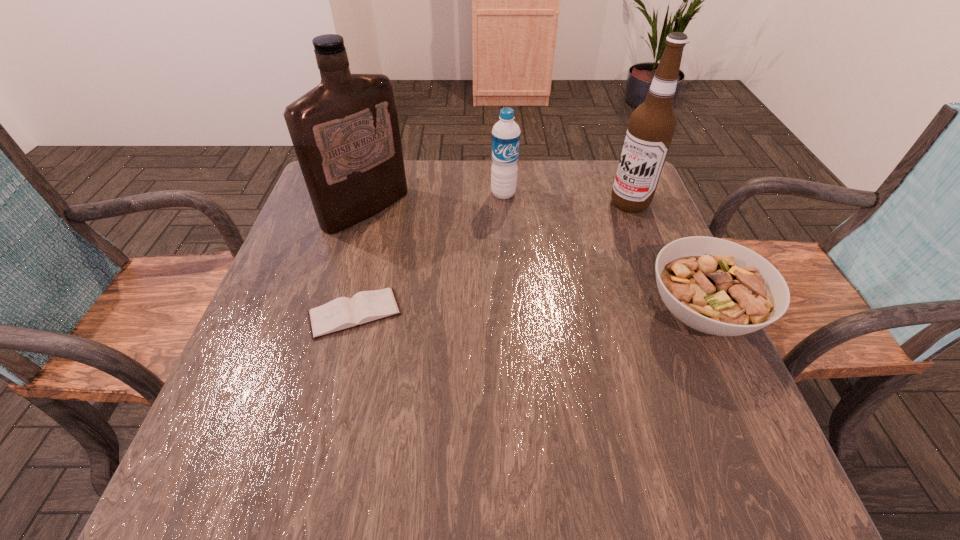
Locate an element on the screen. Image resolution: width=960 pixels, height=540 pixels. vacant space at the near left corner is located at coordinates (284, 404).

This screenshot has height=540, width=960. What are the coordinates of `free space between the second shortest object and the shortest object` in the screenshot? It's located at (528, 313).

Where is `free spot between the diary and the liquor`? free spot between the diary and the liquor is located at coordinates (361, 261).

You are a GUI agent. You are given a task and a screenshot of the screen. Output one action in this format:
    pyautogui.click(x=<x>, y=<y>)
    Task: Click on the free space between the diary and the third object from right to left
    This screenshot has height=540, width=960.
    Given the screenshot: What is the action you would take?
    pyautogui.click(x=429, y=254)

Identify the location of free space between the liquor and the stew. (534, 261).

Find the location of a particular element. The width and height of the screenshot is (960, 540). free area in between the stew and the water bottle is located at coordinates (603, 253).

Locate an element on the screen. free space between the liquor and the third tallest object is located at coordinates (435, 201).

Where is `vacant area that lies between the water bottle and the alcohol`? vacant area that lies between the water bottle and the alcohol is located at coordinates (566, 199).

Identify the location of free space between the diary and the third object from right to left. This screenshot has width=960, height=540. (429, 254).

Find the location of a particular element. This screenshot has height=540, width=960. empty location between the liquor and the diary is located at coordinates (361, 261).